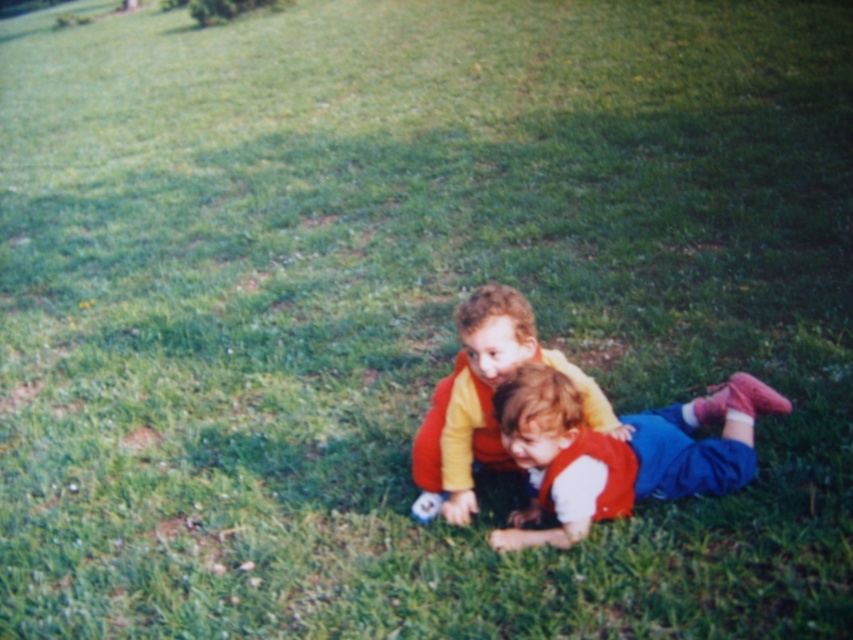
Is matte red vest at center bigger than matte yellow shirt at center?

Yes.

Who is lower down, matte red vest at center or matte yellow shirt at center?

matte red vest at center is below.

Between point (735, 381) and point (556, 349), which one is positioned in front?

Point (735, 381)

Locate an element on the screen. The image size is (853, 640). matte red vest at center is located at coordinates [x=619, y=452].